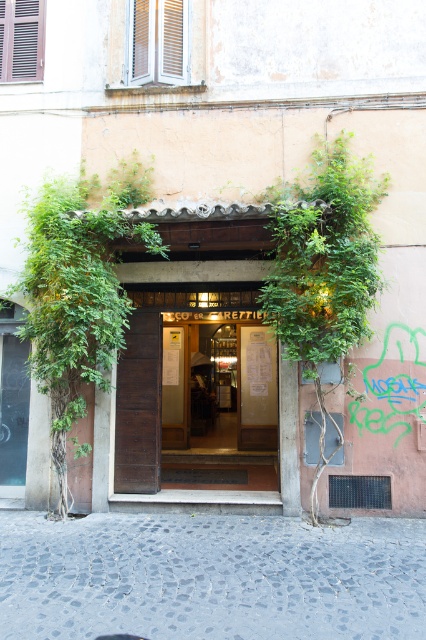
Who is taller, green leafy plant at center or wooden door at center?

With more height is green leafy plant at center.

Between green leafy plant at center and wooden door at center, which one has less height?

wooden door at center is shorter.

From the picture: Measure the distance between point (60, 460) and camera.

Point (60, 460) and camera are 23.11 feet apart from each other.

Where is `green leafy plant at center`? This screenshot has width=426, height=640. green leafy plant at center is located at coordinates (78, 291).